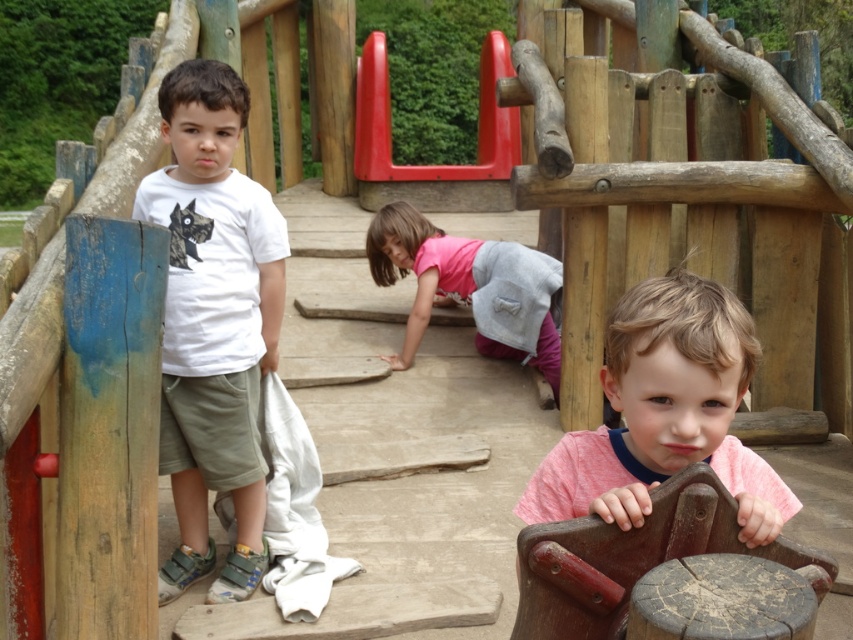
Does white matte t-shirt at left appear on the left side of pink matte shirt at center?

Indeed, white matte t-shirt at left is positioned on the left side of pink matte shirt at center.

Which is behind, point (241, 472) or point (651, 284)?

The point (241, 472) is behind.

The width and height of the screenshot is (853, 640). Identify the location of white matte t-shirt at left. (213, 323).

Can you confirm if white matte t-shirt at left is smaller than smooth plastic slide at upper center?

Yes.

Consider the image. Who is lower down, white matte t-shirt at left or smooth plastic slide at upper center?

Positioned lower is white matte t-shirt at left.

Is point (201, 236) positioned before point (502, 56)?

Yes, it is in front of point (502, 56).

This screenshot has width=853, height=640. Identify the location of white matte t-shirt at left. (213, 323).

Between point (680, 426) and point (582, 564), which one is positioned behind?

Point (680, 426)

I want to click on pink matte shirt at center, so click(665, 413).

Is point (656, 278) positioned in front of point (766, 593)?

No, it is behind (766, 593).

At what (x,y) coordinates should I click in order to perform the action: click on pink matte shirt at center. Please return your answer as a coordinate pair (x, y). The height and width of the screenshot is (640, 853). Looking at the image, I should click on (665, 413).